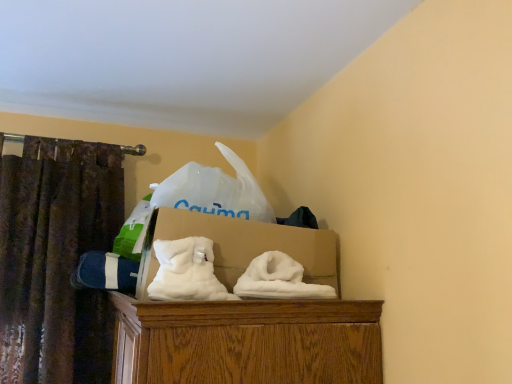
Question: Is brown textured curtain at left next to white cardboard box at center?

Choices:
 (A) yes
 (B) no

Answer: (B)

Question: Is brown textured curtain at left positioned with its back to white cardboard box at center?

Choices:
 (A) yes
 (B) no

Answer: (B)

Question: Can we say brown textured curtain at left lies outside white cardboard box at center?

Choices:
 (A) no
 (B) yes

Answer: (B)

Question: Is white cardboard box at center a part of brown textured curtain at left?

Choices:
 (A) no
 (B) yes

Answer: (A)

Question: Is brown textured curtain at left aimed at white cardboard box at center?

Choices:
 (A) yes
 (B) no

Answer: (B)

Question: From a real-world perspective, is brown textured curtain at left positioned under white cardboard box at center based on gravity?

Choices:
 (A) no
 (B) yes

Answer: (B)

Question: From a real-world perspective, is white cardboard box at center on top of brown textured curtain at left?

Choices:
 (A) yes
 (B) no

Answer: (A)

Question: Is brown textured curtain at left a part of white cardboard box at center?

Choices:
 (A) yes
 (B) no

Answer: (B)

Question: From the image's perspective, is white cardboard box at center located beneath brown textured curtain at left?

Choices:
 (A) no
 (B) yes

Answer: (A)

Question: Does white cardboard box at center appear on the right side of brown textured curtain at left?

Choices:
 (A) no
 (B) yes

Answer: (B)

Question: Considering the relative sizes of white cardboard box at center and brown textured curtain at left in the image provided, is white cardboard box at center thinner than brown textured curtain at left?

Choices:
 (A) yes
 (B) no

Answer: (B)

Question: Considering the relative positions of white cardboard box at center and brown textured curtain at left in the image provided, is white cardboard box at center to the left of brown textured curtain at left from the viewer's perspective?

Choices:
 (A) no
 (B) yes

Answer: (A)

Question: Does point (320, 269) appear closer or farther from the camera than point (16, 233)?

Choices:
 (A) farther
 (B) closer

Answer: (B)